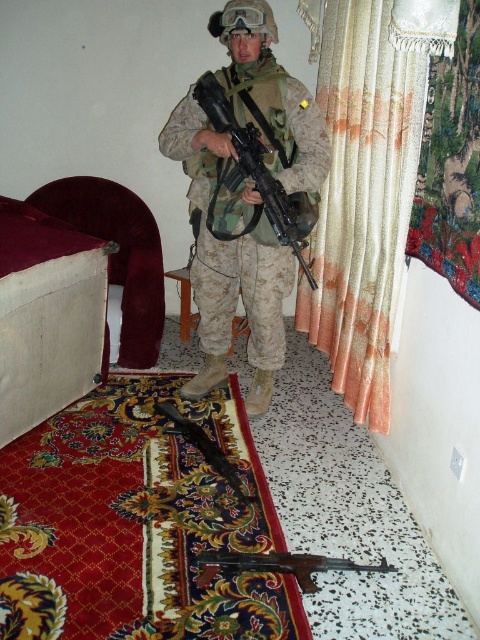
You are a photographer positioned in front of the camouflage fabric uniform at center. You need to capture a closeup shot of the uniform details. If your camera has a minimum focusing distance of 5 feet, will you be able to take the photo without moving closer?

The camouflage fabric uniform at center is 7.61 feet away from the viewer. Since the minimum focusing distance is 5 feet, the photographer can take the closeup shot without moving closer because the distance is within the camera s capability.

You are an arms dealer inspecting a display case with two rifles. The black plastic rifle at center and the matte black rifle at center. Which rifle is shorter in height?

The black plastic rifle at center is not as tall as the matte black rifle at center, so the black plastic rifle at center is shorter in height.

You are a military equipment inspector tasked with verifying the placement of the camouflage fabric uniform at center in the room. Based on the coordinates provided in the description, can you confirm if the uniform is positioned closer to the left wall or the right wall?

The camouflage fabric uniform at center is located at point 0.392 on the x and y axis, which means it is closer to the left wall than the right wall.